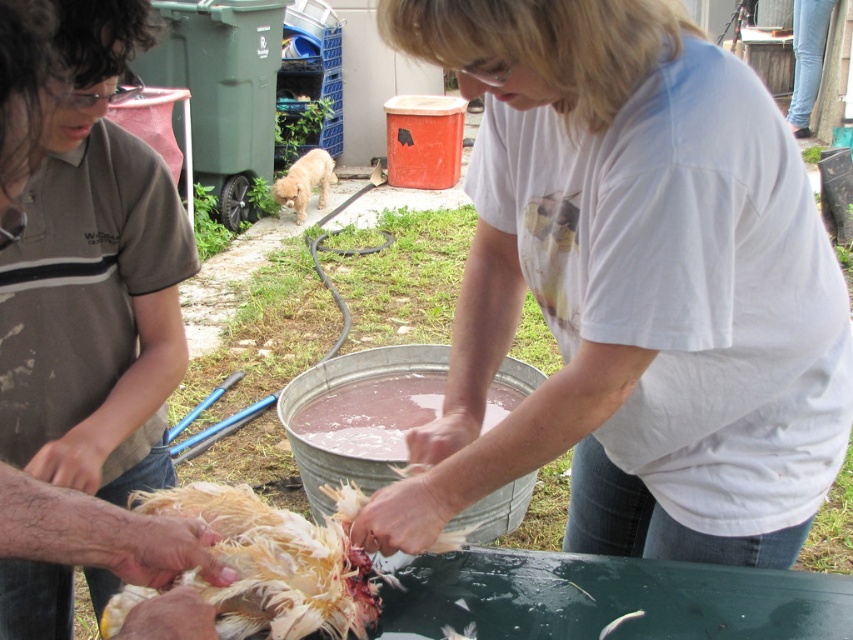
Question: Is white cotton shirt at center positioned before brown cotton shirt at upper left?

Choices:
 (A) yes
 (B) no

Answer: (B)

Question: Is brown cotton shirt at upper left in front of pink translucent liquid at center?

Choices:
 (A) no
 (B) yes

Answer: (B)

Question: Among these objects, which one is farthest from the camera?

Choices:
 (A) brown cotton shirt at upper left
 (B) pink translucent liquid at center
 (C) light brown fur dog at center

Answer: (C)

Question: Does brown cotton shirt at upper left have a larger size compared to light brown fur dog at center?

Choices:
 (A) no
 (B) yes

Answer: (B)

Question: Among these objects, which one is farthest from the camera?

Choices:
 (A) light brown fur dog at center
 (B) white cotton shirt at center
 (C) brown cotton shirt at upper left

Answer: (A)

Question: Which of the following is the farthest from the observer?

Choices:
 (A) brown cotton shirt at upper left
 (B) light brown fur dog at center
 (C) pink translucent liquid at center
 (D) white cotton shirt at center

Answer: (B)